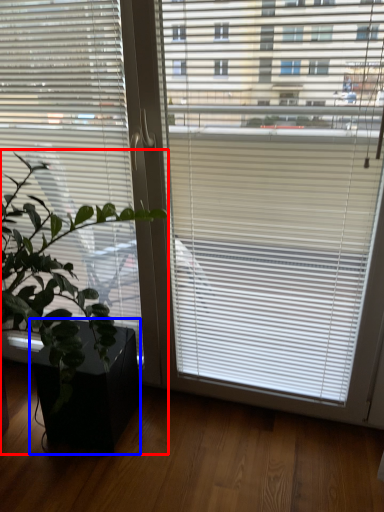
Question: Among these objects, which one is nearest to the camera, houseplant (highlighted by a red box) or flowerpot (highlighted by a blue box)?

Choices:
 (A) houseplant
 (B) flowerpot

Answer: (A)